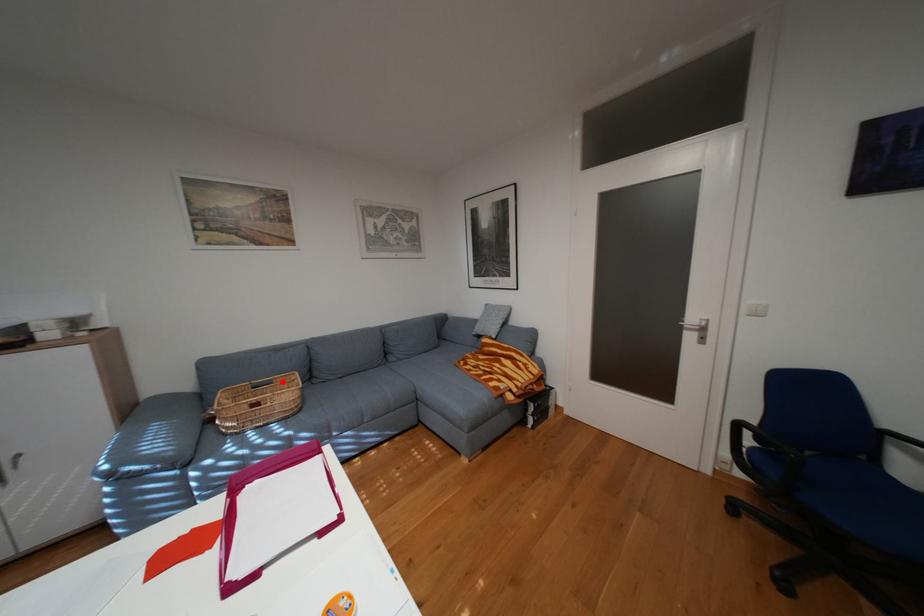
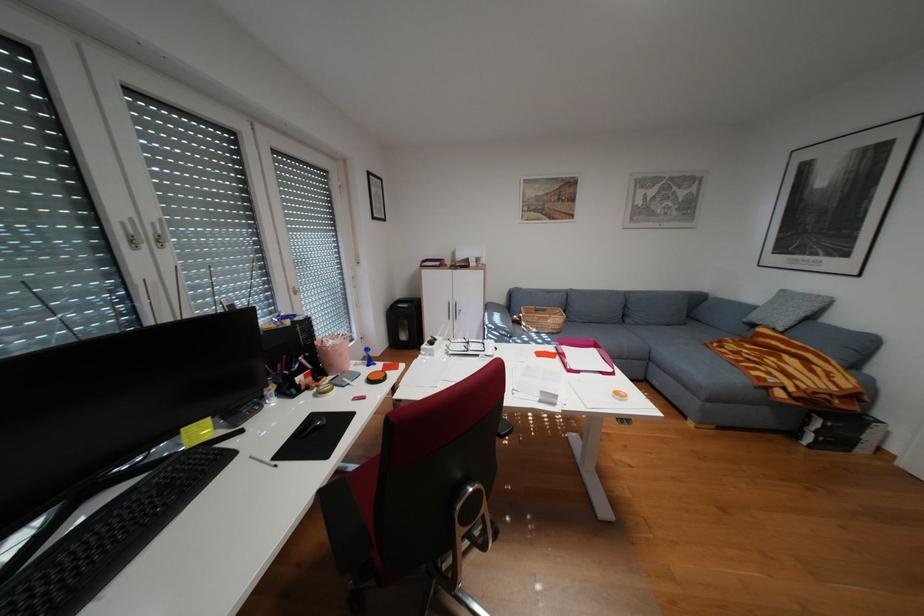
Where in the second image is the point corresponding to the highlighted location from the first image?

(556, 310)